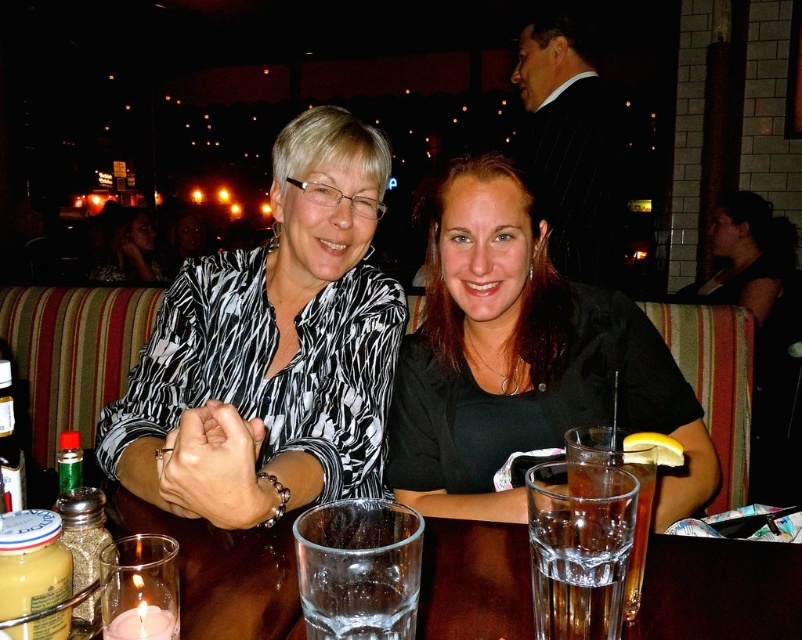
Is printed fabric blouse at center shorter than clear glass at center?

No, printed fabric blouse at center is not shorter than clear glass at center.

Does printed fabric blouse at center appear over clear glass at center?

Yes.

Does point (318, 404) lie behind point (794, 577)?

Yes.

I want to click on printed fabric blouse at center, so click(x=270, y=349).

The width and height of the screenshot is (802, 640). What do you see at coordinates (358, 570) in the screenshot?
I see `transparent glass at center` at bounding box center [358, 570].

Is transparent glass at center to the left of transparent glass at lower center from the viewer's perspective?

Correct, you'll find transparent glass at center to the left of transparent glass at lower center.

Identify the location of transparent glass at center. Image resolution: width=802 pixels, height=640 pixels. (358, 570).

Can you confirm if black suit at upper center is thinner than transparent glass at center?

In fact, black suit at upper center might be wider than transparent glass at center.

Which of these two, black suit at upper center or transparent glass at center, stands taller?

Standing taller between the two is black suit at upper center.

Which is behind, point (533, 147) or point (331, 598)?

The point (533, 147) is behind.

Find the location of a particular element. The height and width of the screenshot is (640, 802). black suit at upper center is located at coordinates (570, 148).